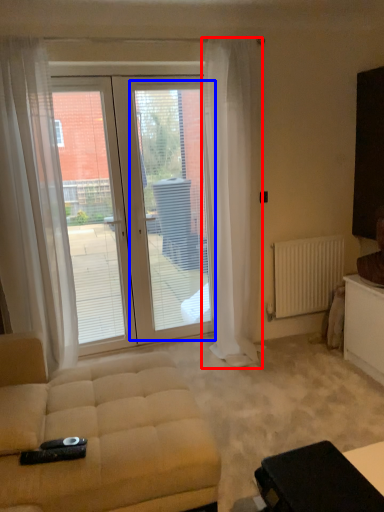
Question: Which object is closer to the camera taking this photo, curtain (highlighted by a red box) or screen door (highlighted by a blue box)?

Choices:
 (A) curtain
 (B) screen door

Answer: (A)